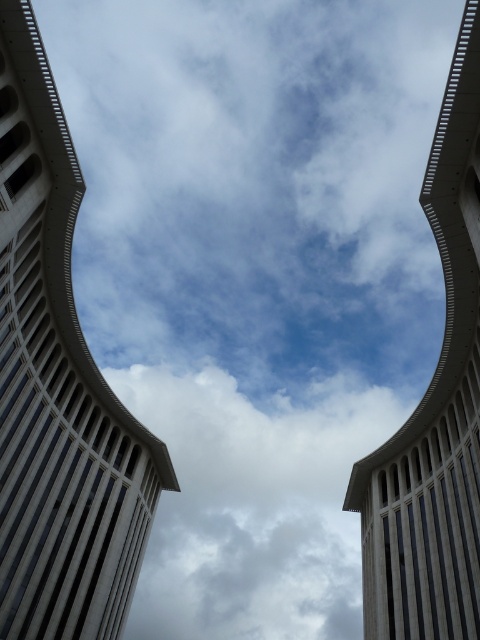
Question: Is white fluffy cloud at center behind gray concrete tower at center?

Choices:
 (A) no
 (B) yes

Answer: (B)

Question: Which point is farther from the camera taking this photo?

Choices:
 (A) (279, 502)
 (B) (456, 193)
 (C) (140, 451)

Answer: (A)

Question: Which object appears farthest from the camera in this image?

Choices:
 (A) white fluffy cloud at center
 (B) gray concrete tower at center
 (C) white concrete tower at upper left

Answer: (A)

Question: Is white concrete tower at upper left closer to the viewer compared to gray concrete tower at center?

Choices:
 (A) yes
 (B) no

Answer: (B)

Question: Can you confirm if white fluffy cloud at center is thinner than gray concrete tower at center?

Choices:
 (A) yes
 (B) no

Answer: (B)

Question: Which object is positioned farthest from the gray concrete tower at center?

Choices:
 (A) white fluffy cloud at center
 (B) white concrete tower at upper left

Answer: (A)